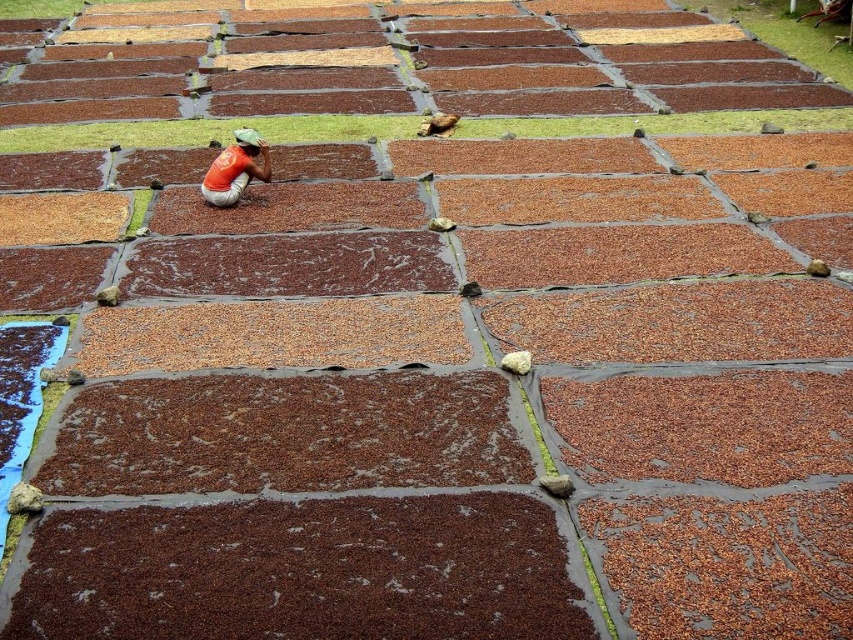
Where is `brown rough mud at bottom`? brown rough mud at bottom is located at coordinates (302, 572).

Locate an element on the screen. This screenshot has height=640, width=853. brown rough mud at bottom is located at coordinates (302, 572).